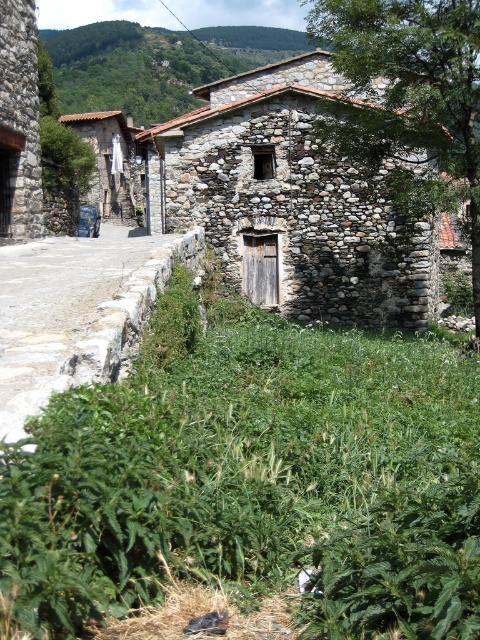
Between green leafy grass at center and green leafy tree at center, which one is positioned lower?

green leafy grass at center is lower down.

Which is behind, point (180, 381) or point (356, 108)?

The point (356, 108) is behind.

Which is in front, point (193, 300) or point (356, 140)?

Point (193, 300)

Where is `green leafy grass at center`? The height and width of the screenshot is (640, 480). green leafy grass at center is located at coordinates [252, 476].